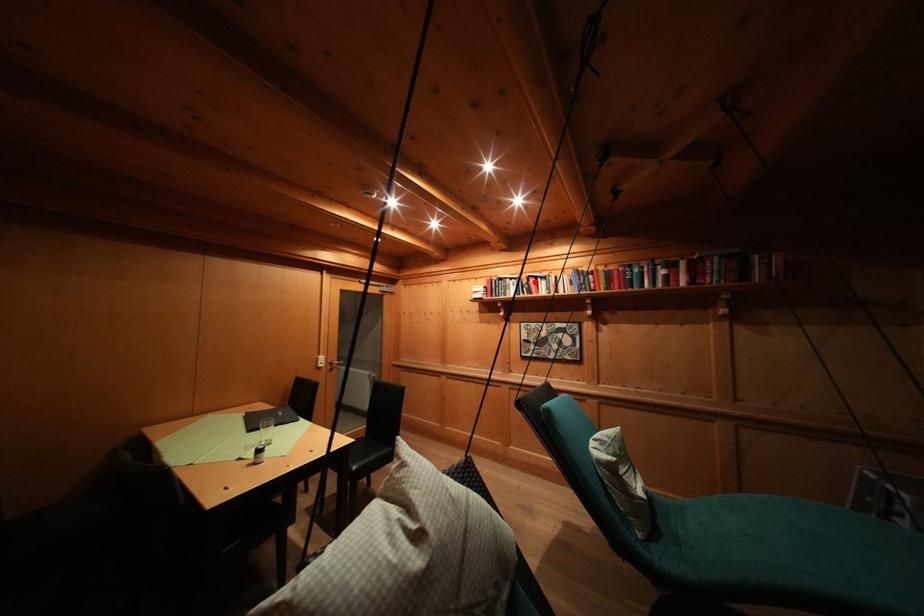
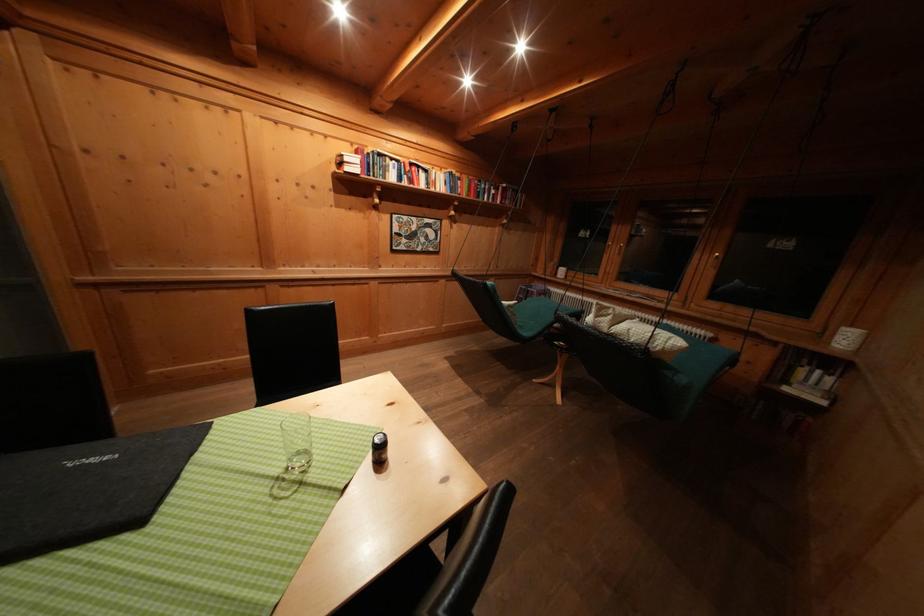
In the second image, find the point that corresponds to the highlighted location in the first image.

(418, 169)